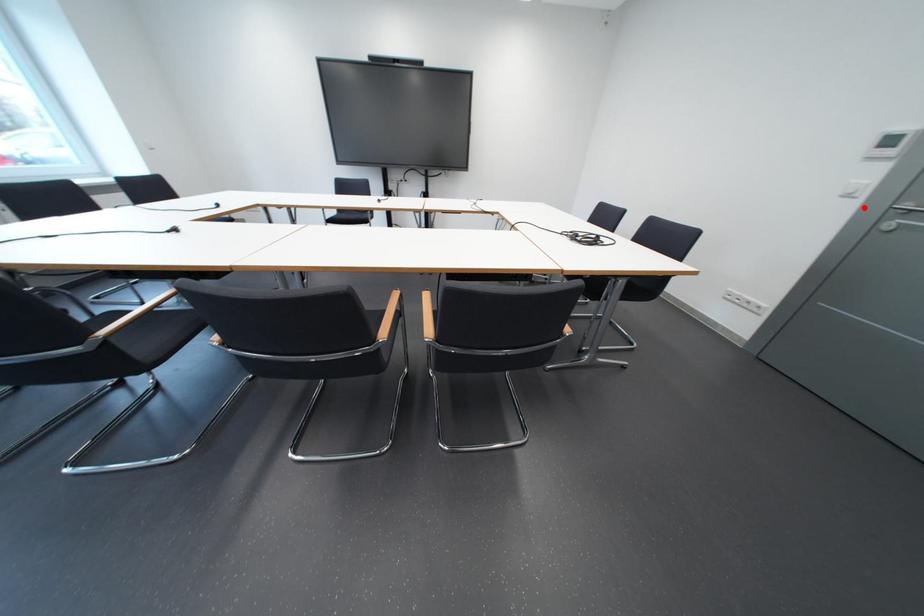
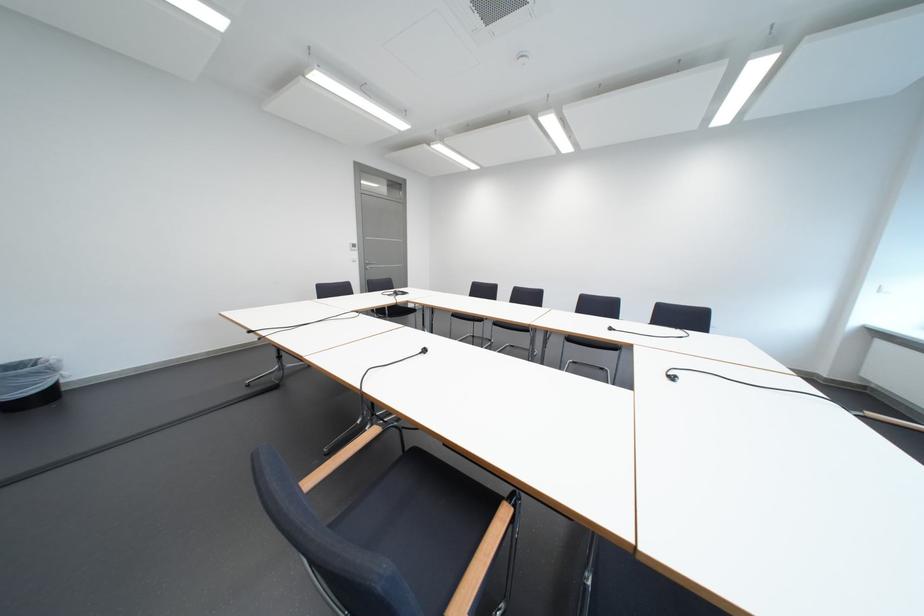
Question: I am providing you with two images of the same scene from different viewpoints. Given a red point in image1, look at the same physical point in image2. Is it:

Choices:
 (A) Closer to the viewpoint
 (B) Farther from the viewpoint

Answer: (A)